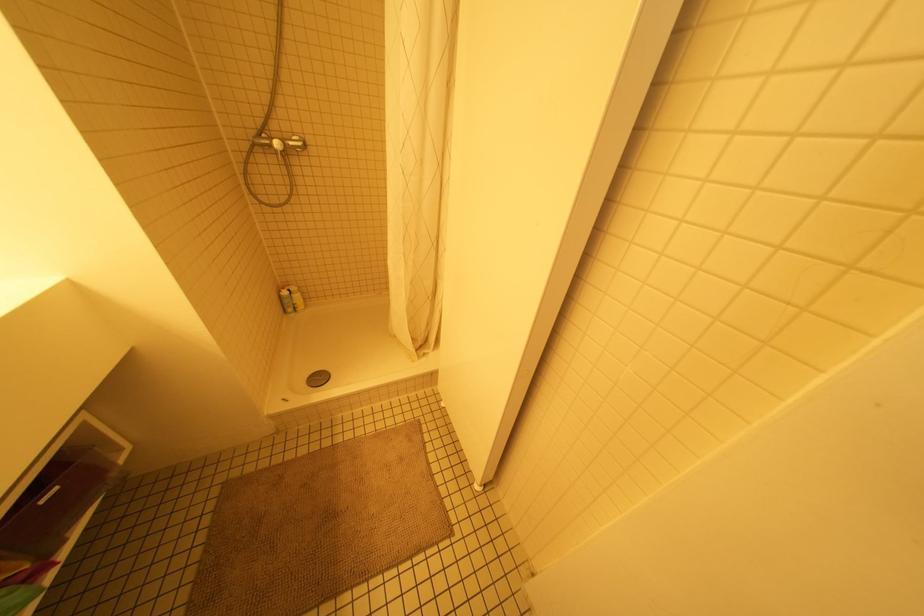
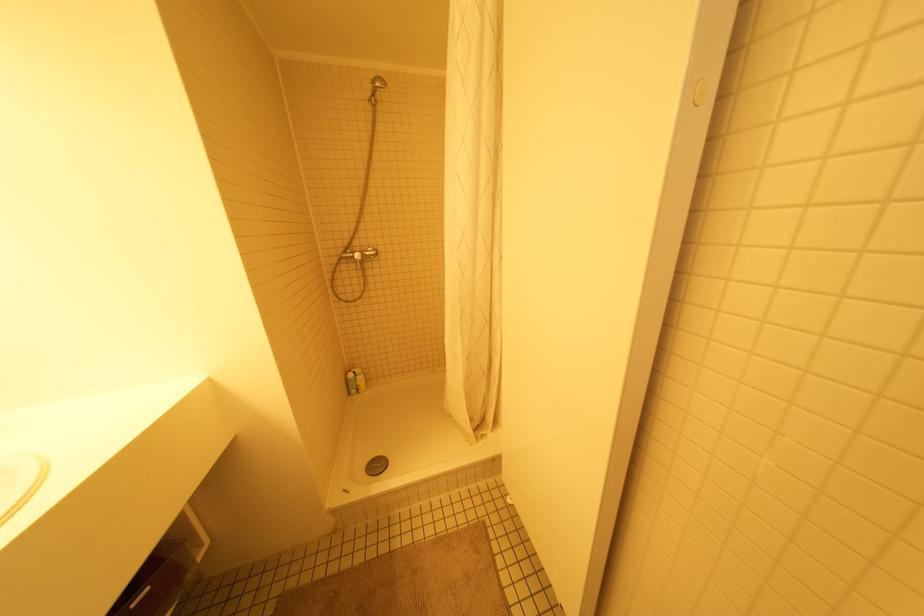
Question: How did the camera likely rotate?

Choices:
 (A) Left
 (B) Right
 (C) Up
 (D) Down

Answer: (C)